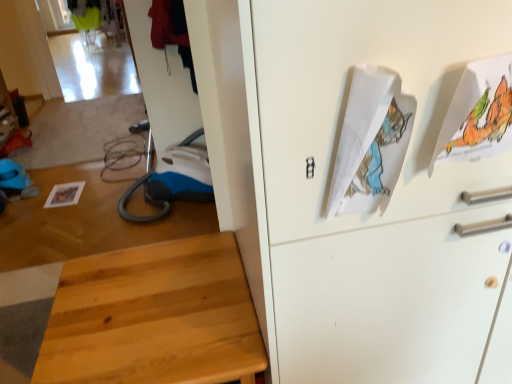
Question: Based on their positions, is white paper with colorful illustration at upper right, the 1th wrapping paper viewed from the right, located to the left or right of light wood stool at lower left?

Choices:
 (A) right
 (B) left

Answer: (A)

Question: Considering the positions of white paper with colorful illustration at upper right, which is the second wrapping paper from left to right, and light wood stool at lower left in the image, is white paper with colorful illustration at upper right, which is the second wrapping paper from left to right, bigger or smaller than light wood stool at lower left?

Choices:
 (A) big
 (B) small

Answer: (B)

Question: Estimate the real-world distances between objects in this image. Which object is closer to the white paper with colorful illustration at upper right, which is the second wrapping paper from left to right?

Choices:
 (A) light wood stool at lower left
 (B) white paper at upper right, the 1th wrapping paper viewed from the left

Answer: (B)

Question: Considering the real-world distances, which object is farthest from the white paper at upper right, which is counted as the second wrapping paper, starting from the right?

Choices:
 (A) light wood stool at lower left
 (B) white paper with colorful illustration at upper right, the 1th wrapping paper viewed from the right

Answer: (A)